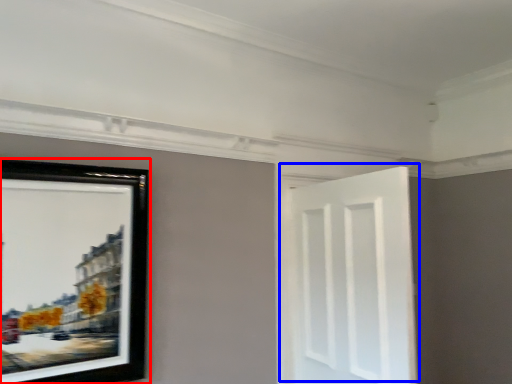
Question: Which object is further to the camera taking this photo, picture frame (highlighted by a red box) or door (highlighted by a blue box)?

Choices:
 (A) picture frame
 (B) door

Answer: (B)